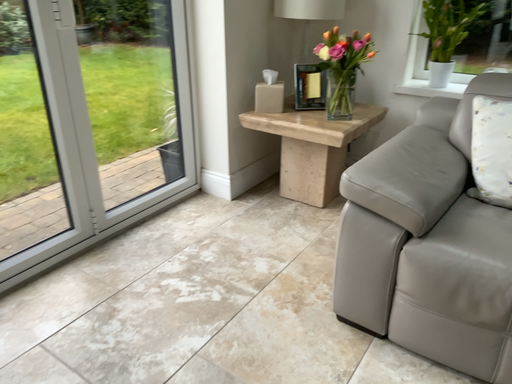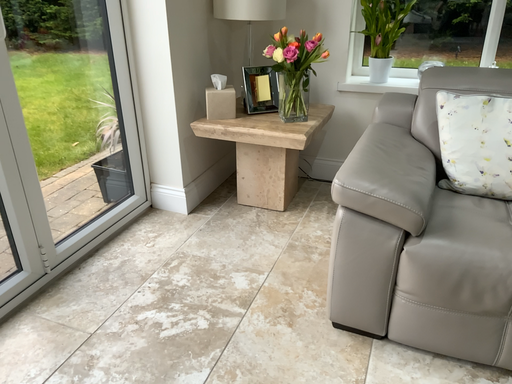
Question: Which way did the camera rotate in the video?

Choices:
 (A) rotated left
 (B) rotated right

Answer: (B)